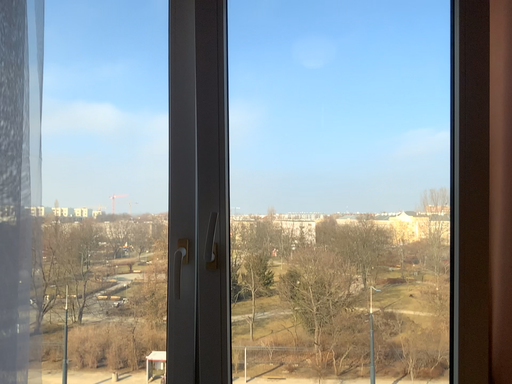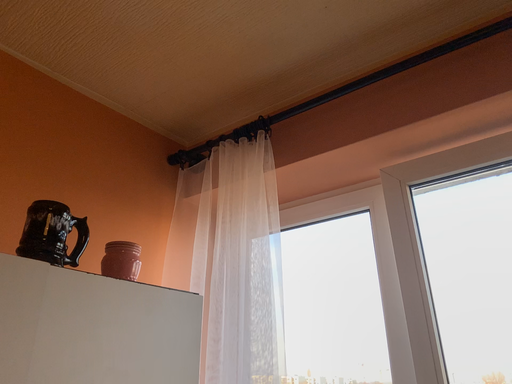
Question: How did the camera likely rotate when shooting the video?

Choices:
 (A) rotated upward
 (B) rotated downward

Answer: (A)